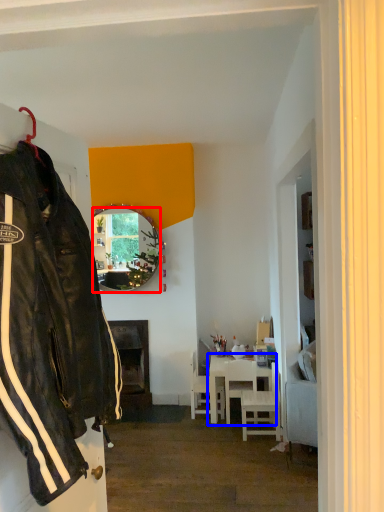
Question: Which point is closer to the camera, mirror (highlighted by a red box) or table (highlighted by a blue box)?

Choices:
 (A) mirror
 (B) table

Answer: (B)